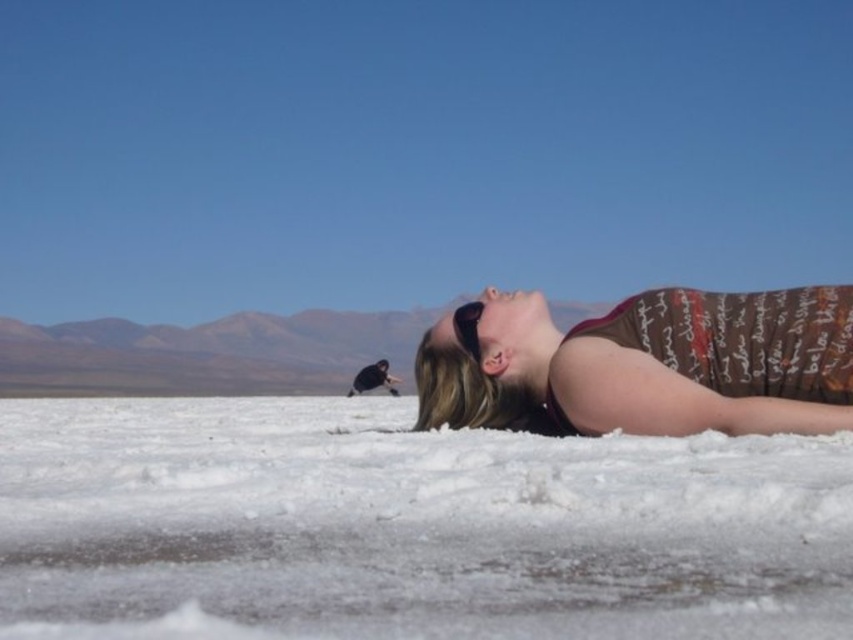
Does brown printed fabric at lower right have a greater width compared to black matte sunglasses at upper center?

Yes.

This screenshot has height=640, width=853. I want to click on brown printed fabric at lower right, so click(x=741, y=339).

Is white powdery snow at lower center closer to camera compared to brown printed tank top at center?

Yes, white powdery snow at lower center is closer to the viewer.

Find the location of a particular element. white powdery snow at lower center is located at coordinates (407, 525).

Is point (814, 602) farther from camera compared to point (824, 392)?

That is False.

You are a GUI agent. You are given a task and a screenshot of the screen. Output one action in this format:
    pyautogui.click(x=<x>, y=<y>)
    Task: Click on the white powdery snow at lower center
    
    Given the screenshot: What is the action you would take?
    click(407, 525)

Is point (231, 564) behind point (659, 346)?

No, it is in front of (659, 346).

Does white powdery snow at lower center have a smaller size compared to brown printed fabric at lower right?

No.

Identify the location of white powdery snow at lower center. The height and width of the screenshot is (640, 853). (407, 525).

Find the location of `white powdery snow at lower center`. white powdery snow at lower center is located at coordinates (407, 525).